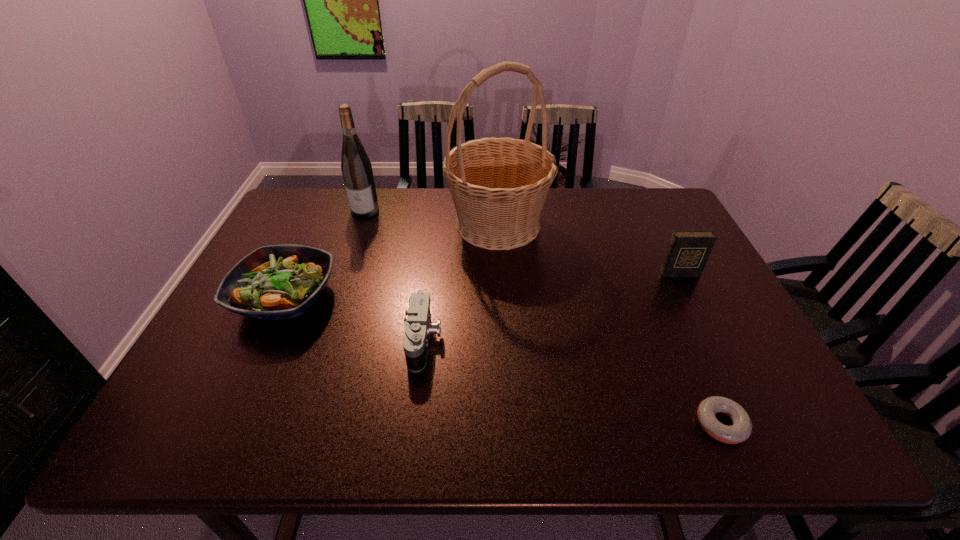
What are the coordinates of `the tallest object` in the screenshot? It's located at (499, 185).

Find the location of `wine bottle`. wine bottle is located at coordinates (356, 167).

Where is `the third tallest object`? The width and height of the screenshot is (960, 540). the third tallest object is located at coordinates (688, 251).

Locate an element on the screen. salad plate is located at coordinates (274, 282).

You are a GUI agent. You are given a task and a screenshot of the screen. Output one action in this format:
    pyautogui.click(x=<x>, y=<y>)
    Task: Click on the camera
    This screenshot has width=960, height=540.
    Given the screenshot: What is the action you would take?
    pyautogui.click(x=418, y=327)

The width and height of the screenshot is (960, 540). Find the location of `the shortest object`. the shortest object is located at coordinates (740, 431).

Locate an element on the screen. doughnut is located at coordinates (740, 431).

Where is `vacant region located 0.150m on the front of the basket`? The width and height of the screenshot is (960, 540). vacant region located 0.150m on the front of the basket is located at coordinates (502, 293).

This screenshot has height=540, width=960. I want to click on vacant space situated 0.160m on the right of the wine bottle, so click(x=428, y=210).

Identify the location of vacant space located 0.130m on the front cover of the third tallest object. This screenshot has width=960, height=540. (699, 312).